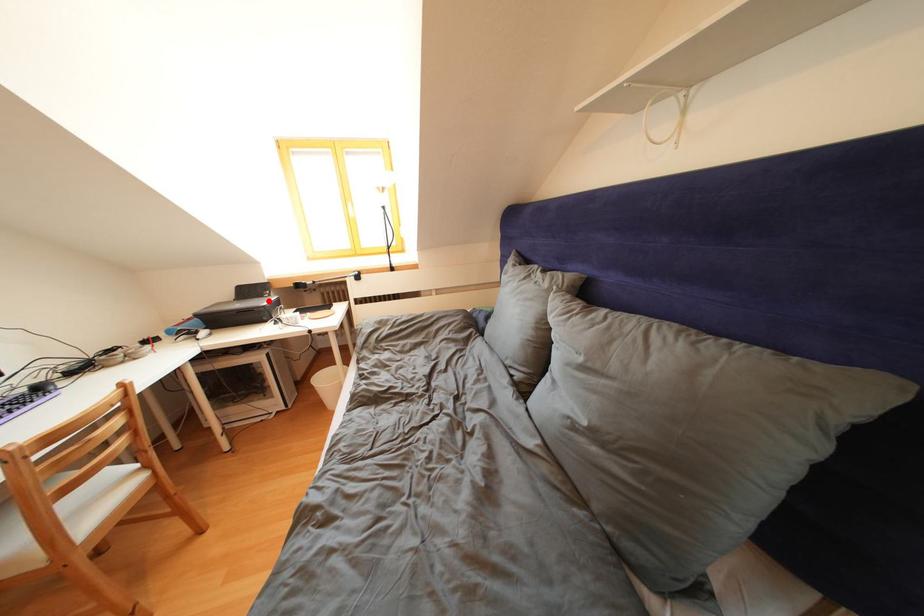
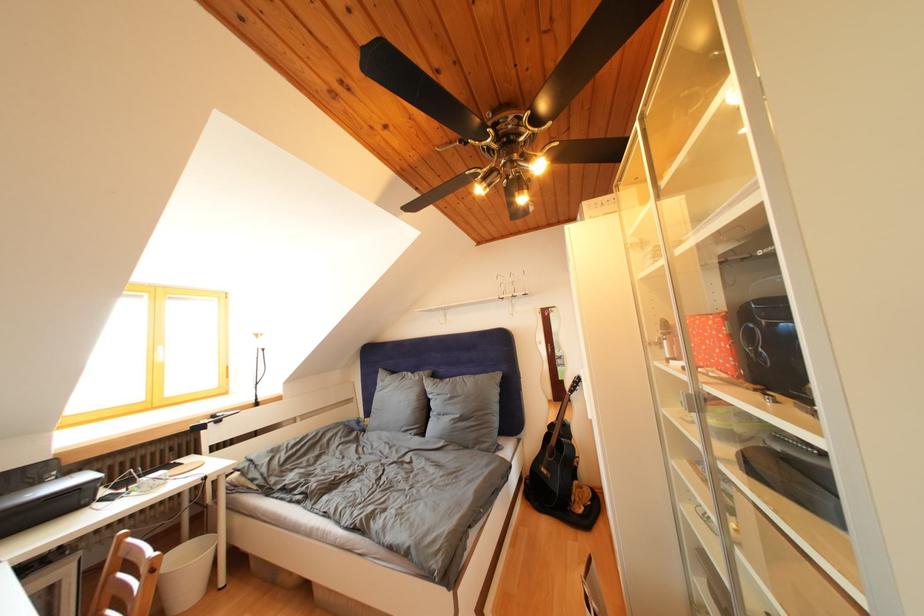
Find the pixel in the second image that matches the highlighted location in the first image.

(44, 488)